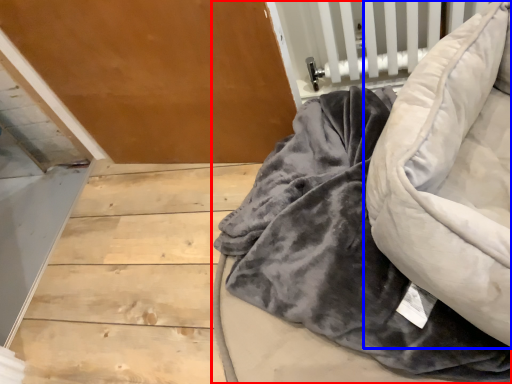
Question: Which of the following is the farthest to the observer, furniture (highlighted by a red box) or bean bag chair (highlighted by a blue box)?

Choices:
 (A) furniture
 (B) bean bag chair

Answer: (A)